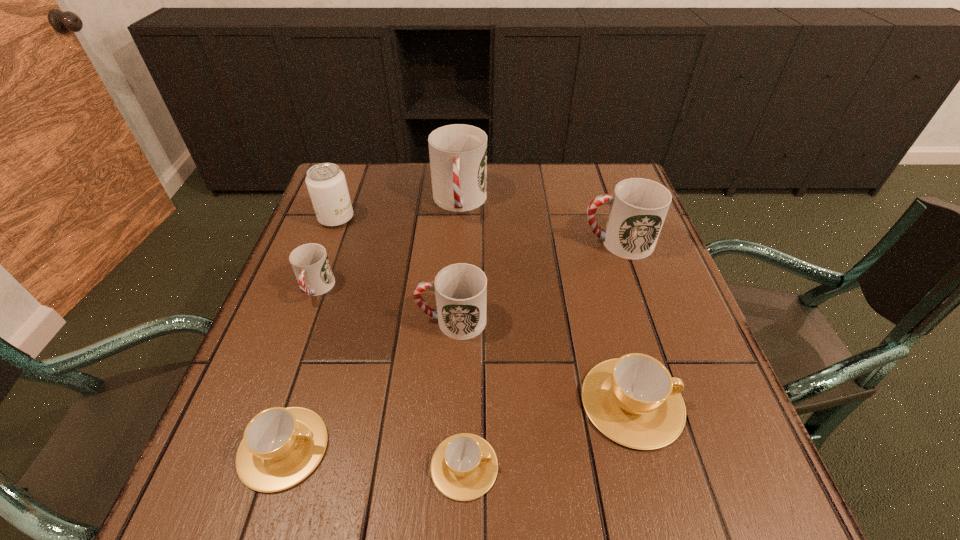
In the image, there is a desktop. Where is `vacant space at the far edge`? The width and height of the screenshot is (960, 540). vacant space at the far edge is located at coordinates (542, 177).

This screenshot has width=960, height=540. Find the location of `vacant area at the near edge`. vacant area at the near edge is located at coordinates (615, 513).

In the image, there is a desktop. Identify the location of vacant space at the left edge. Image resolution: width=960 pixels, height=540 pixels. (346, 244).

At what (x,y) coordinates should I click in order to perform the action: click on blank space at the right edge of the desktop. Please return your answer as a coordinate pair (x, y). The image size is (960, 540). Looking at the image, I should click on (744, 437).

Find the location of a particular element. The image size is (960, 540). vacant point at the far right corner is located at coordinates (619, 174).

What are the coordinates of `free region at the near right corner` in the screenshot? It's located at (757, 505).

Where is `unoccupied position between the second biggest red cup and the shortest cup`? unoccupied position between the second biggest red cup and the shortest cup is located at coordinates (540, 354).

This screenshot has height=540, width=960. I want to click on vacant area that lies between the rightmost red cup and the rightmost brown cup, so click(625, 322).

I want to click on unoccupied area between the tallest cup and the fifth shortest cup, so click(x=456, y=261).

You are a GUI agent. You are given a task and a screenshot of the screen. Output one action in this format:
    pyautogui.click(x=<x>, y=<y>)
    Task: Click on the empty space between the second shortest object and the rightmost red cup
    This screenshot has height=540, width=960.
    Given the screenshot: What is the action you would take?
    pyautogui.click(x=450, y=345)